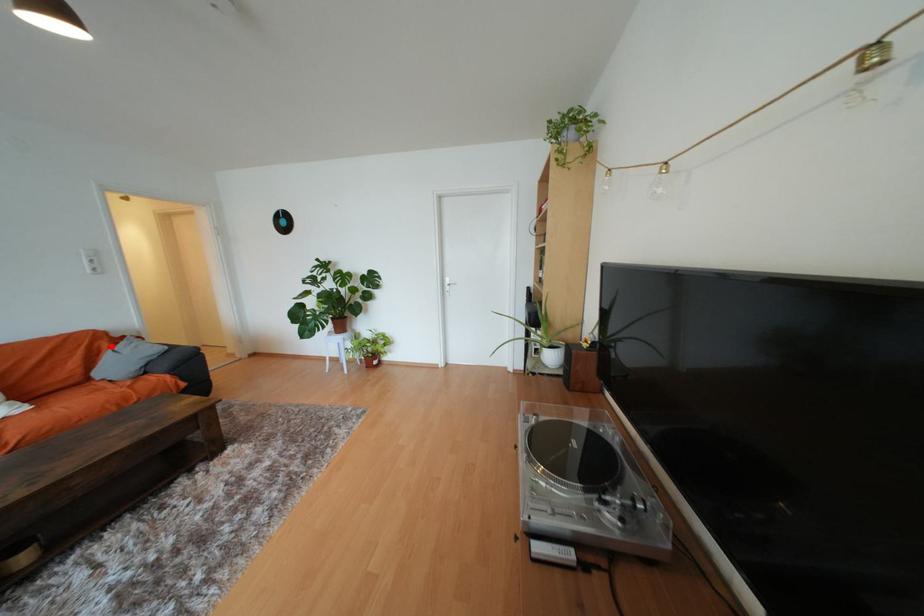
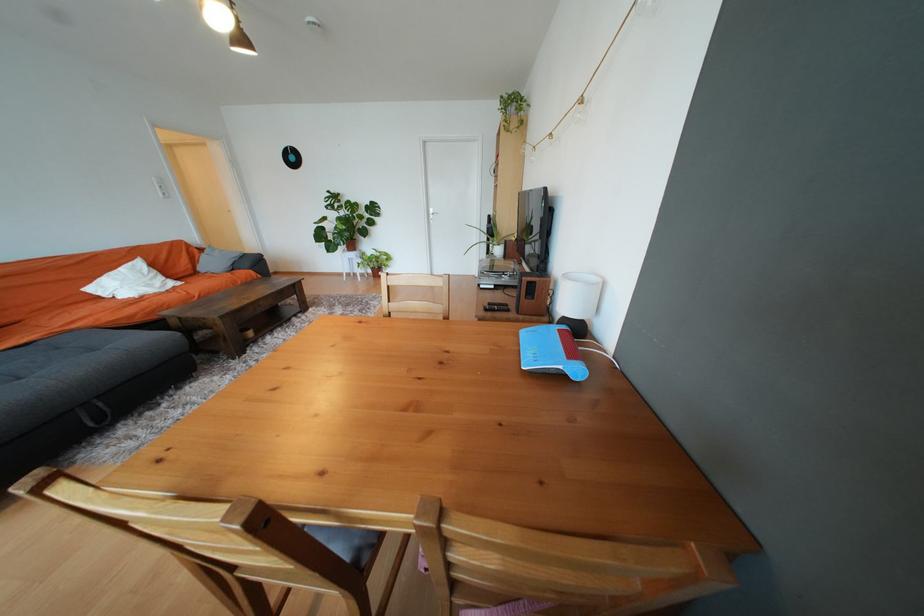
Question: I am providing you with two images of the same scene from different viewpoints. A red point is shown in image1. For the corresponding object point in image2, is it positioned nearer or farther from the camera?

Choices:
 (A) Nearer
 (B) Farther

Answer: (A)